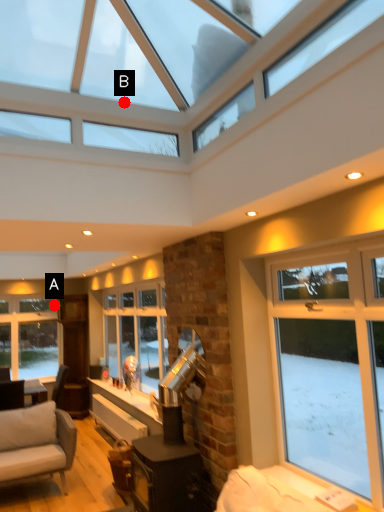
Question: Two points are circled on the image, labeled by A and B beside each circle. Which point is closer to the camera?

Choices:
 (A) A is closer
 (B) B is closer

Answer: (B)